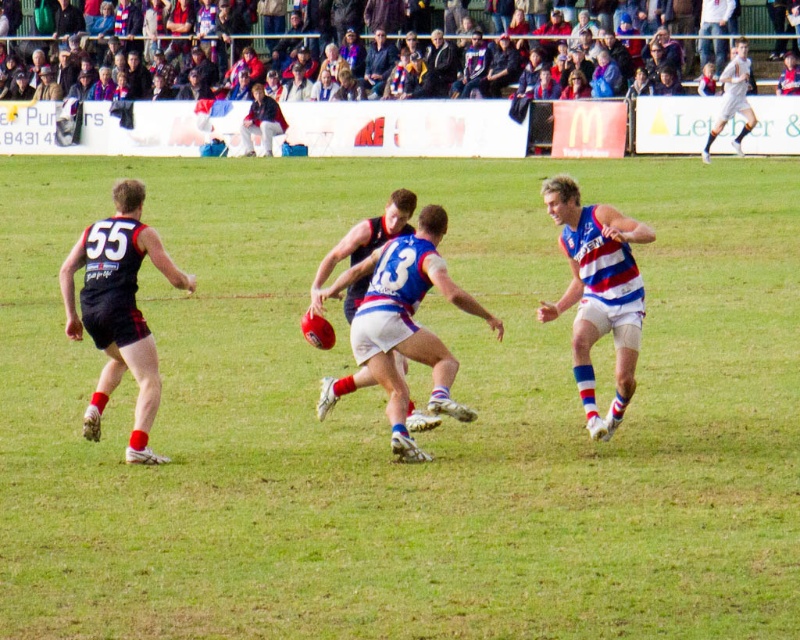
Question: Which point appears closest to the camera in this image?

Choices:
 (A) (745, 22)
 (B) (262, 131)
 (C) (124, 352)
 (D) (728, 116)

Answer: (C)

Question: Among these points, which one is nearest to the camera?

Choices:
 (A) (582, 289)
 (B) (724, 96)
 (C) (397, 234)
 (D) (692, 19)

Answer: (A)

Question: Can you confirm if multicolored fabric seats at upper center is smaller than light brown leather jacket at upper center?

Choices:
 (A) yes
 (B) no

Answer: (B)

Question: Is blue and white jersey at center closer to the viewer compared to light gray uniform at upper right?

Choices:
 (A) yes
 (B) no

Answer: (A)

Question: From the image, what is the correct spatial relationship of blue and white jersey at center in relation to dark blue suit at center?

Choices:
 (A) right
 (B) left

Answer: (A)

Question: Which of the following is the farthest from the observer?

Choices:
 (A) (386, 49)
 (B) (112, 244)
 (C) (744, 33)

Answer: (A)